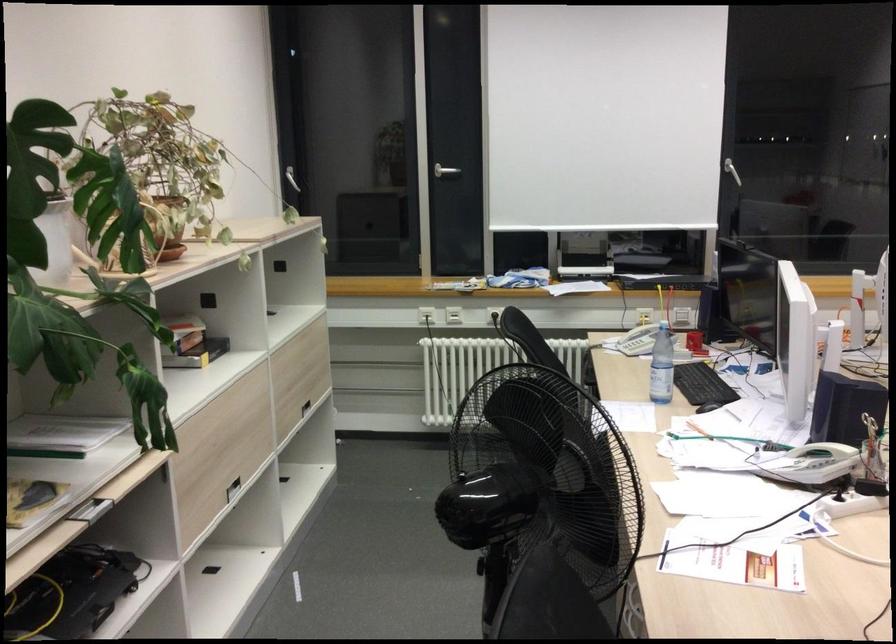
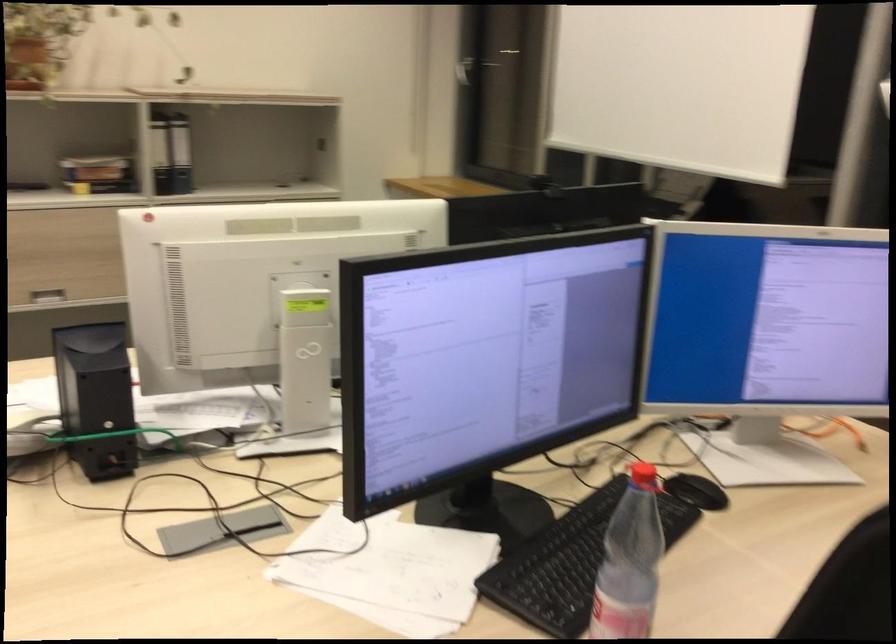
Question: I am providing you with two images of the same scene from different viewpoints. Please identify which objects are invisible in image2.

Choices:
 (A) silver cabinet handle
 (B) red bottle cap
 (C) drawer handle
 (D) grey keypad button

Answer: (C)